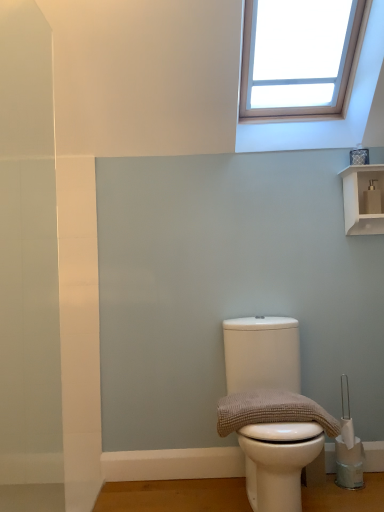
Question: Visually, is white matte toilet at center positioned to the left or to the right of white glossy shelf at upper right?

Choices:
 (A) left
 (B) right

Answer: (A)

Question: From their relative heights in the image, would you say white matte toilet at center is taller or shorter than white glossy shelf at upper right?

Choices:
 (A) short
 (B) tall

Answer: (B)

Question: Which object is the closest to the brown textured towel at center?

Choices:
 (A) white glossy shelf at upper right
 (B) white matte toilet at center

Answer: (B)

Question: Which of these objects is positioned farthest from the white matte toilet at center?

Choices:
 (A) brown textured towel at center
 (B) white glossy shelf at upper right

Answer: (B)